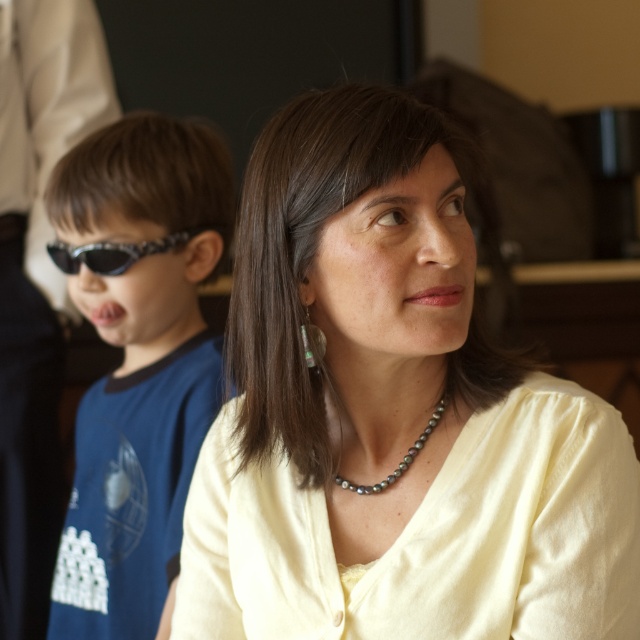
Consider the image. Does sunglasses at left have a greater height compared to pearl-like necklace at center?

Yes.

Locate an element on the screen. The width and height of the screenshot is (640, 640). sunglasses at left is located at coordinates (136, 358).

Does point (68, 205) come behind point (356, 490)?

Yes, it is behind point (356, 490).

The height and width of the screenshot is (640, 640). In order to click on sunglasses at left in this screenshot , I will do `click(136, 358)`.

Measure the distance between point (x=422, y=260) and camera.

Point (x=422, y=260) is 33.74 inches away from camera.

Which of these two, matte yellow blouse at center or sunglasses at left, stands shorter?

matte yellow blouse at center

Is point (419, 550) farther from camera compared to point (106, 600)?

No.

Identify the location of matte yellow blouse at center. (392, 413).

Can you confirm if matte yellow blouse at center is taller than black plastic sunglasses at left?

Indeed, matte yellow blouse at center has a greater height compared to black plastic sunglasses at left.

Who is positioned more to the left, matte yellow blouse at center or black plastic sunglasses at left?

From the viewer's perspective, black plastic sunglasses at left appears more on the left side.

Between point (426, 129) and point (93, 268), which one is positioned behind?

Point (93, 268)

You are a GUI agent. You are given a task and a screenshot of the screen. Output one action in this format:
    pyautogui.click(x=<x>, y=<y>)
    Task: Click on the matte yellow blouse at center
    The height and width of the screenshot is (640, 640).
    Given the screenshot: What is the action you would take?
    pyautogui.click(x=392, y=413)